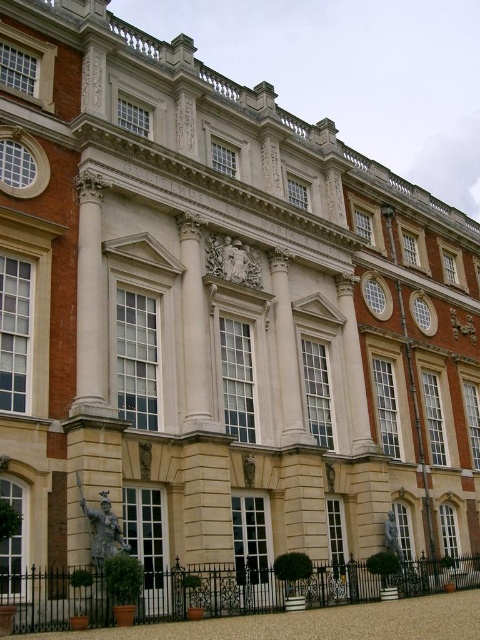
Question: Can you confirm if bronze statue at center is positioned below bronze statue at lower center?

Choices:
 (A) yes
 (B) no

Answer: (B)

Question: Which object is closer to the camera taking this photo?

Choices:
 (A) bronze statue at center
 (B) bronze statue at lower center

Answer: (A)

Question: Which point is closer to the camera taking this photo?

Choices:
 (A) (100, 520)
 (B) (403, 561)

Answer: (A)

Question: Is bronze statue at center closer to the viewer compared to bronze statue at lower center?

Choices:
 (A) no
 (B) yes

Answer: (B)

Question: Does bronze statue at center have a smaller size compared to bronze statue at lower center?

Choices:
 (A) no
 (B) yes

Answer: (A)

Question: Among these objects, which one is farthest from the camera?

Choices:
 (A) bronze statue at center
 (B) bronze statue at lower center

Answer: (B)